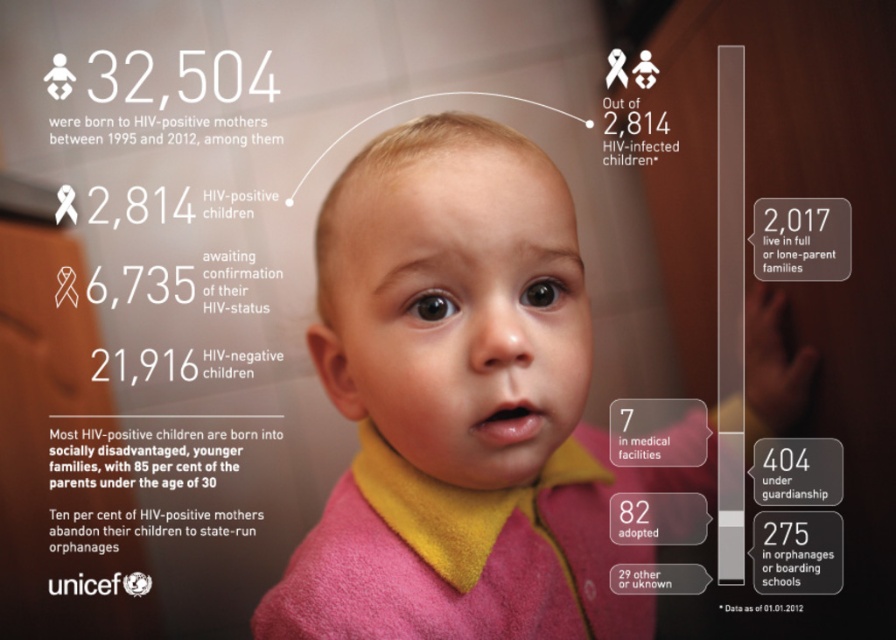
You are a UNICEF researcher analyzing the image. You need to determine if the pink fleece jacket at center and the pink fleece robe at center are positioned close enough to each other to suggest they belong to the same child. The minimum distance required for this assumption is 2 inches. Can you confirm?

The pink fleece jacket at center is 2.26 inches away from the pink fleece robe at center. Since the required minimum distance is 2 inches, the distance between them exceeds this threshold. Therefore, they are not positioned close enough to suggest they belong to the same child.

You are a photographer who wants to focus on the pink fleece jacket at center and the pink fleece robe at center in the image. Which one is closer to the camera?

The pink fleece jacket at center is in front of the pink fleece robe at center, so the jacket is closer to the camera.